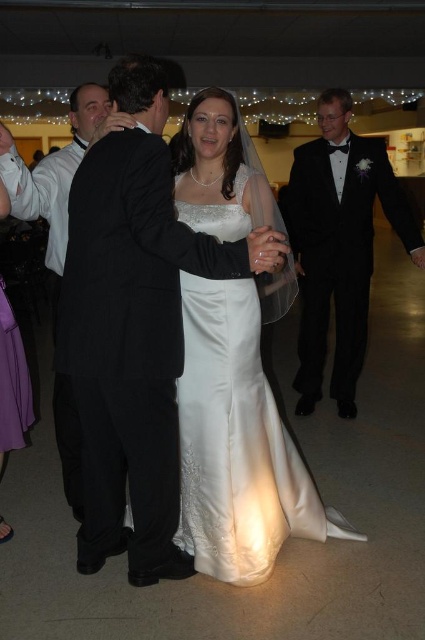
You are a photographer at the wedding reception. You need to capture a photo of the two points mentioned. The first point is labeled as point (184,348) and the second is point (48,260). From your current position, which point is closer to you?

Point (184,348) is in front of point (48,260), so the first point is closer to you.